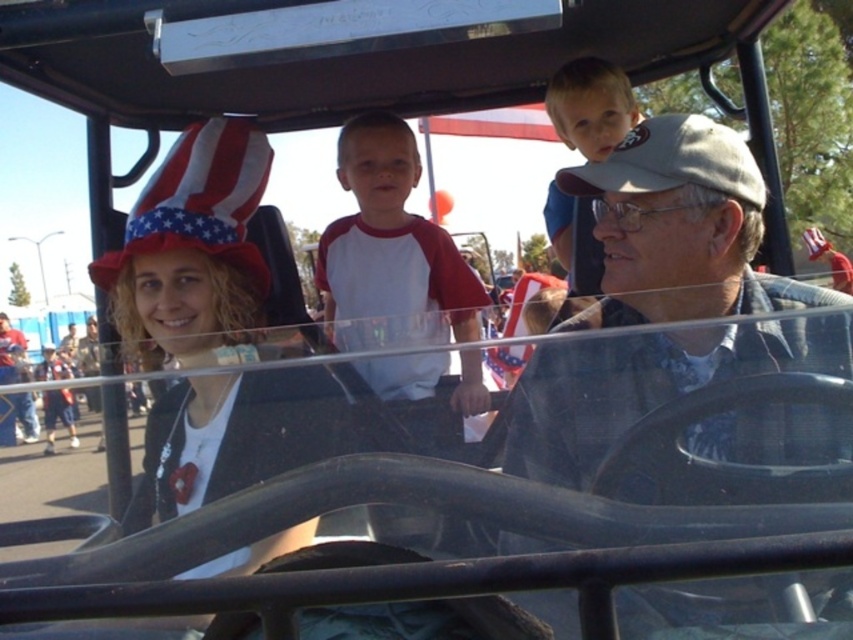
You are a photographer standing near the golf cart and want to take a picture of the light brown hair at upper center and the matte white shirt at center. Which object should you focus on first if you want to capture both in the same frame without adjusting your camera angle?

The light brown hair at upper center is not as tall as the matte white shirt at center, so you should focus on the matte white shirt at center first to ensure both are in the frame.